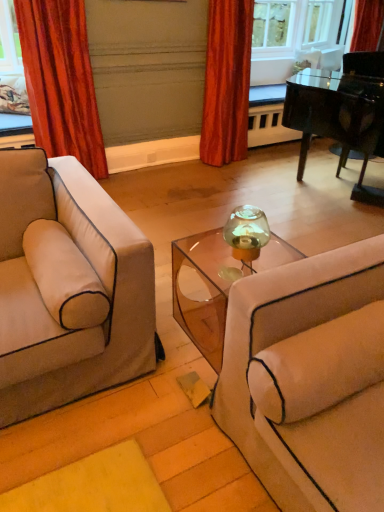
At what (x,y) coordinates should I click in order to perform the action: click on free spot to the right of velvet orange curtain at left, marked as the second curtain in a right-to-left arrangement. Please return your answer as a coordinate pair (x, y). This screenshot has width=384, height=512. Looking at the image, I should click on [x=131, y=191].